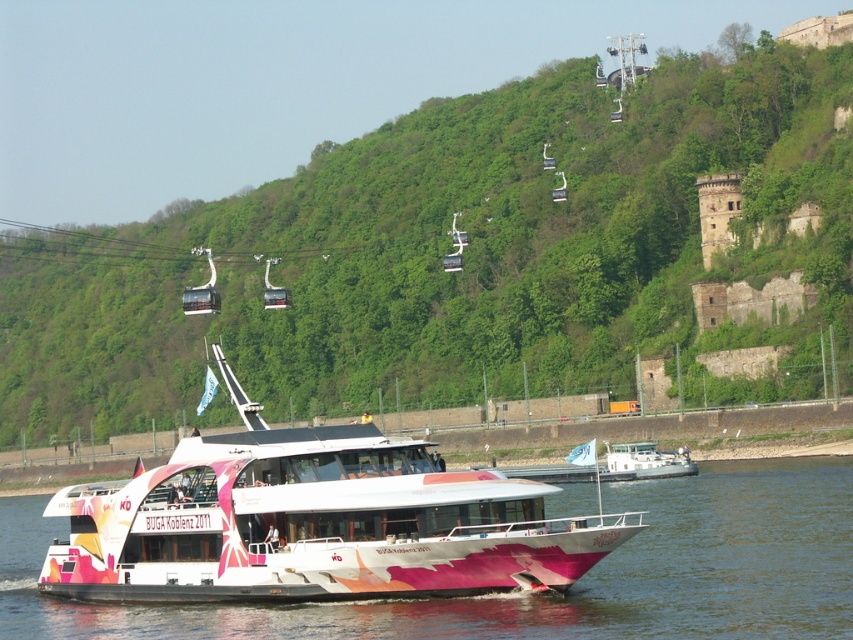
You are a photographer planning to capture the entire scene of the green leafy hillside at upper center and the white glossy boat at center in one shot. Considering their widths, which object will require you to adjust your camera angle more to ensure it fits fully in the frame?

The green leafy hillside at upper center requires more adjustment because its width surpasses that of the white glossy boat at center, meaning it occupies more space in the frame.